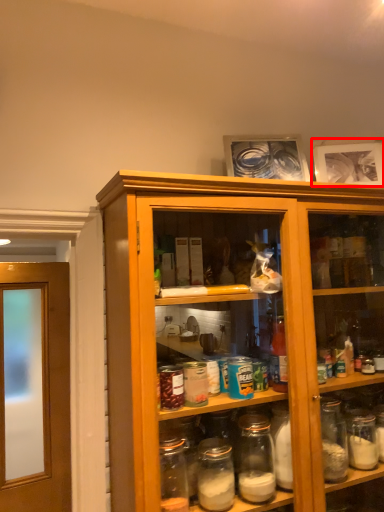
Question: From the image's perspective, what is the correct spatial relationship of picture frame (annotated by the red box) in relation to picture frame?

Choices:
 (A) above
 (B) below

Answer: (B)